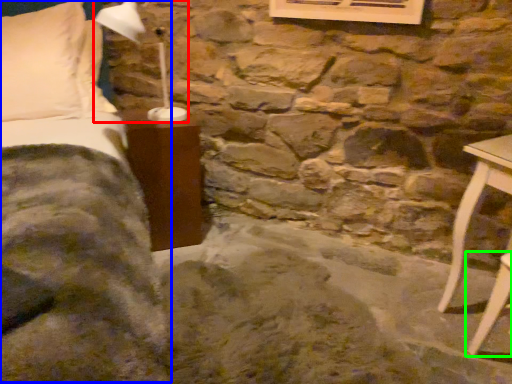
Question: Considering the real-world distances, which object is closest to table lamp (highlighted by a red box)? bed (highlighted by a blue box) or furniture (highlighted by a green box).

Choices:
 (A) bed
 (B) furniture

Answer: (A)